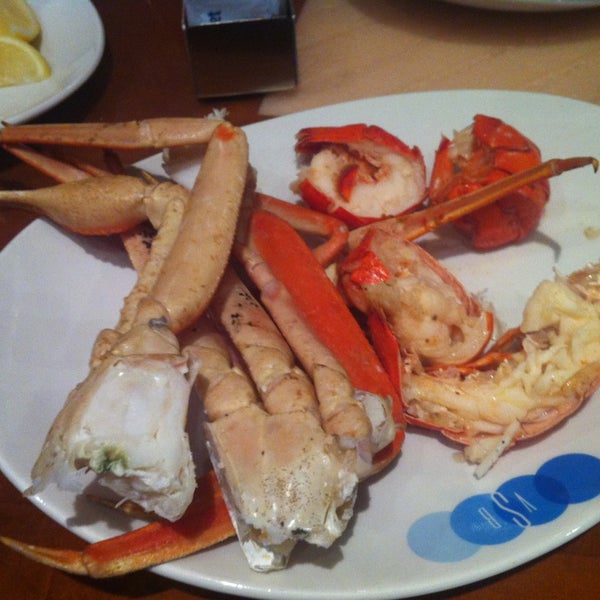
The width and height of the screenshot is (600, 600). What are the coordinates of `wood table` in the screenshot? It's located at (436, 52).